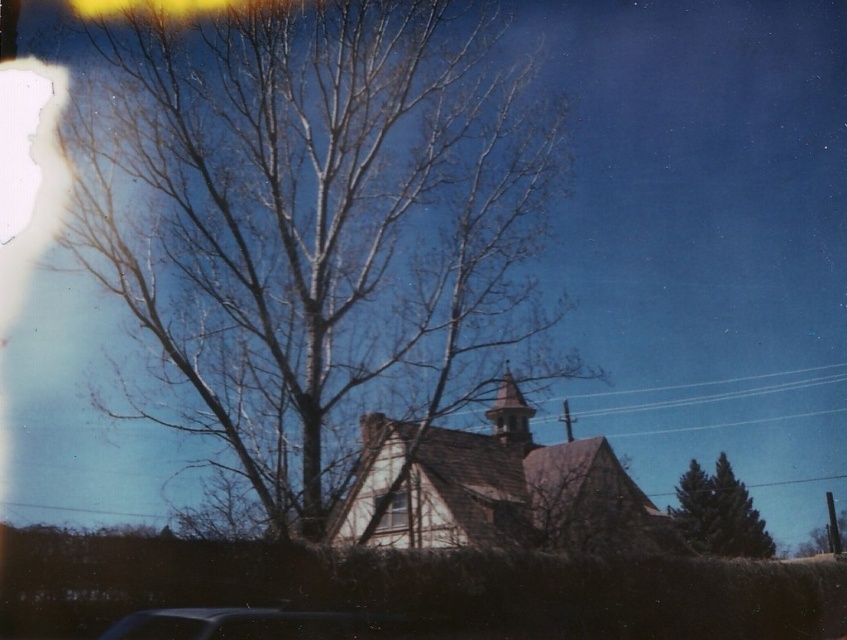
Question: Which object appears farthest from the camera in this image?

Choices:
 (A) wooden spire at center
 (B) wooden church at center
 (C) green needle-like tree at lower right

Answer: (C)

Question: Among these points, which one is nearest to the camera?

Choices:
 (A) (194, 28)
 (B) (702, 516)
 (C) (756, 538)

Answer: (A)

Question: Among these points, which one is farthest from the camera?

Choices:
 (A) (363, 429)
 (B) (324, 168)
 (C) (275, 624)
 (D) (712, 538)

Answer: (D)

Question: Can you confirm if green textured pine tree at lower right is bigger than transparent glass window at center?

Choices:
 (A) yes
 (B) no

Answer: (A)

Question: Does bare wood tree at center appear on the left side of wooden church at center?

Choices:
 (A) yes
 (B) no

Answer: (A)

Question: Is bare wood tree at center positioned behind shiny black car at lower center?

Choices:
 (A) no
 (B) yes

Answer: (B)